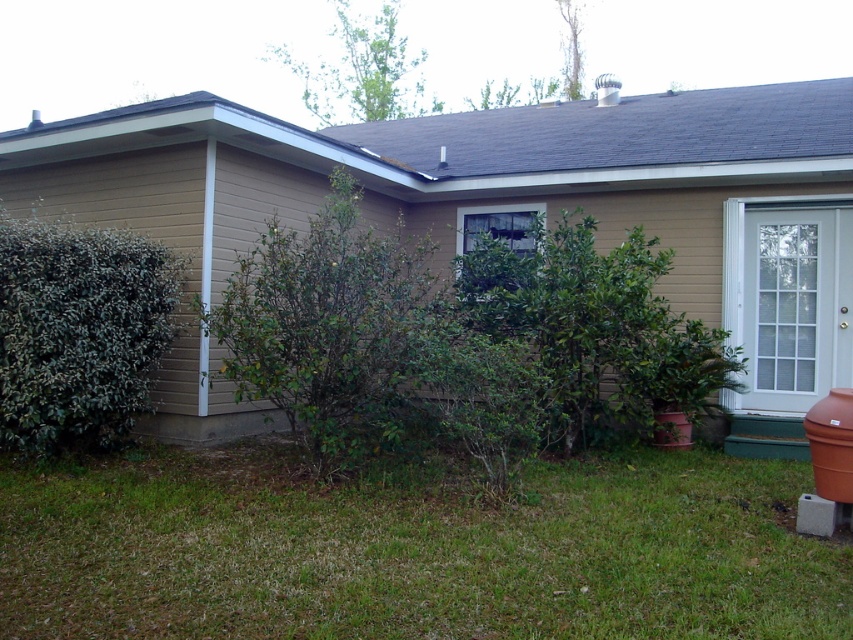
Is green grass at lower center to the left of green leafy bush at left from the viewer's perspective?

Incorrect, green grass at lower center is not on the left side of green leafy bush at left.

Is green grass at lower center further to the viewer compared to green leafy bush at left?

That is False.

Who is more distant from viewer, (502, 625) or (100, 445)?

Positioned behind is point (100, 445).

The width and height of the screenshot is (853, 640). I want to click on green grass at lower center, so click(x=413, y=550).

Does green leafy bush at center appear over green leafy bush at left?

Indeed, green leafy bush at center is positioned over green leafy bush at left.

Can you confirm if green leafy bush at center is shorter than green leafy bush at left?

Incorrect, green leafy bush at center's height does not fall short of green leafy bush at left's.

Does point (347, 228) come in front of point (13, 225)?

That is True.

Locate an element on the screen. green leafy bush at center is located at coordinates (329, 326).

Who is shorter, green grass at lower center or green leafy bush at center?

green grass at lower center

Is green grass at lower center bigger than green leafy bush at center?

No.

Describe the element at coordinates (413, 550) in the screenshot. I see `green grass at lower center` at that location.

The image size is (853, 640). What are the coordinates of `green grass at lower center` in the screenshot? It's located at (413, 550).